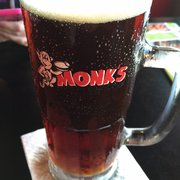
You are a GUI agent. You are given a task and a screenshot of the screen. Output one action in this format:
    pyautogui.click(x=<x>, y=<y>)
    Task: Click on the black tabletop
    
    Given the screenshot: What is the action you would take?
    pyautogui.click(x=11, y=93)